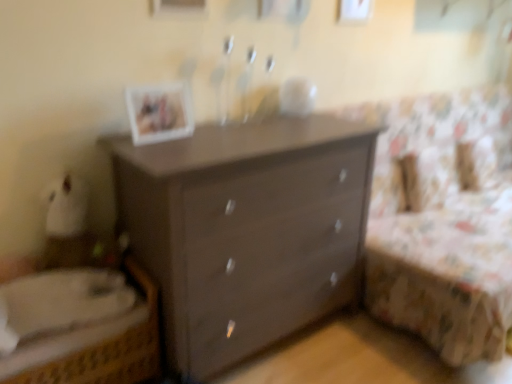
Question: Is woven wicker bed at lower left wider or thinner than matte brown dresser at center?

Choices:
 (A) wide
 (B) thin

Answer: (B)

Question: Based on their sizes in the image, would you say woven wicker bed at lower left is bigger or smaller than matte brown dresser at center?

Choices:
 (A) big
 (B) small

Answer: (B)

Question: Estimate the real-world distances between objects in this image. Which object is farther from the woven wicker bed at lower left?

Choices:
 (A) floral fabric bed at right
 (B) matte brown dresser at center
 (C) matte white picture frame at upper center

Answer: (A)

Question: Which object is the farthest from the floral fabric bed at right?

Choices:
 (A) matte white picture frame at upper center
 (B) woven wicker bed at lower left
 (C) matte brown dresser at center

Answer: (B)